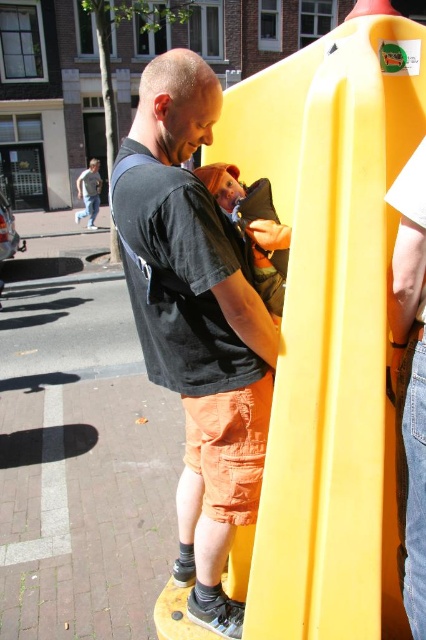
You are a photographer positioned at point A. You want to take a photo of the man holding the baby and the yellow structure. The yellow structure is at point B. You are told that point A is at point (281, 300) and point B is at point (210, 480). If you are at point A, will the man holding the baby block your view of the yellow structure?

Point (210, 480) is behind point (281, 300), so the man holding the baby at point (281, 300) will block your view of the yellow structure at point (210, 480).

You are a photographer trying to capture a candid shot of the man and baby without them noticing. You want to position yourself so that the yellow plastic slide at center is to your left and the matte black shirt at center is to your right. Is this possible given their positions?

The yellow plastic slide at center is positioned on the right side of matte black shirt at center, so if you want the yellow plastic slide at center to be to your left and the matte black shirt at center to your right, you would need to position yourself such that the slide is on your left and the shirt is on your right. However, since the slide is already to the right of the shirt, this arrangement is not possible without moving either the objects or your position in a way that contradicts their current sp

You are a photographer trying to capture the man and the baby in the center of the image. The matte black shirt at center is positioned at coordinates 0.503, 0.460. If you want to ensure the shirt is centered in your shot, where should you aim your camera?

The matte black shirt at center is already positioned at the coordinates [195,321], which is the center of the image. Therefore, aiming your camera at this point will ensure the shirt is centered in the shot.